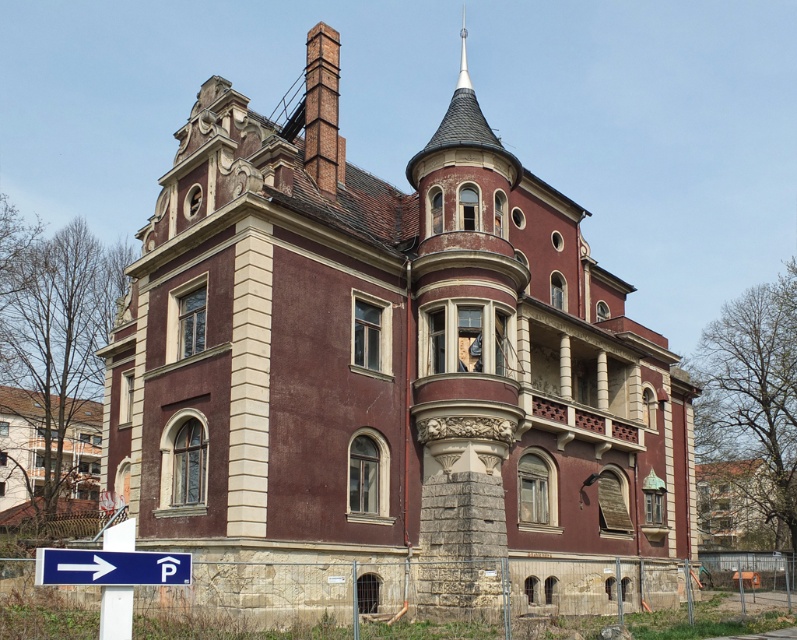
You are a delivery person trying to navigate to the maroon stone mansion at center. You see a blue plastic arrow at lower left pointing towards the mansion. Given that the mansion is wider than the arrow, can you estimate the direction the arrow is pointing relative to the mansion?

The blue plastic arrow at lower left points towards the maroon stone mansion at center. Since the mansion is wider than the arrow, the arrow must be pointing towards the mansion from its left side.

You are a delivery person trying to find the entrance to the maroon stone mansion at center. You have a map that marks a specific point at coordinates point (391, 365). According to the map, where is this point located?

The point (391, 365) is on the maroon stone mansion at center, so the entrance is likely located there.

You are a delivery driver trying to navigate to the rustic stone mansion at upper left. There is a blue plastic arrow at lower left pointing towards the mansion. Given that the mansion is wider than the arrow, can you see the entire mansion from your current viewpoint?

The rustic stone mansion at upper left is wider than the blue plastic arrow at lower left. Since the mansion is wider, you can see the entire mansion from your current viewpoint as it is not obstructed by the arrow.